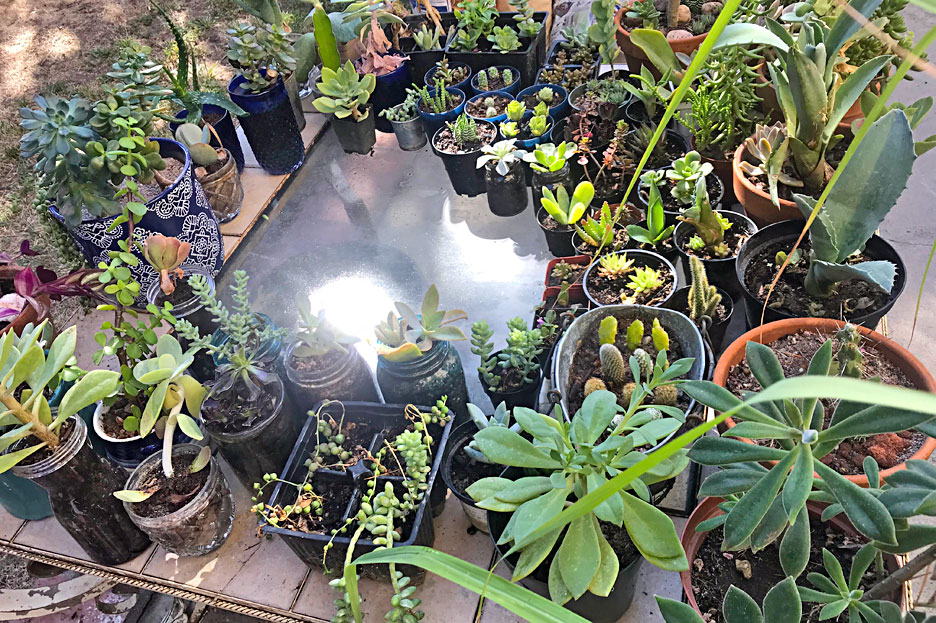
Identify the location of red pot. This screenshot has width=936, height=623. (768, 329).